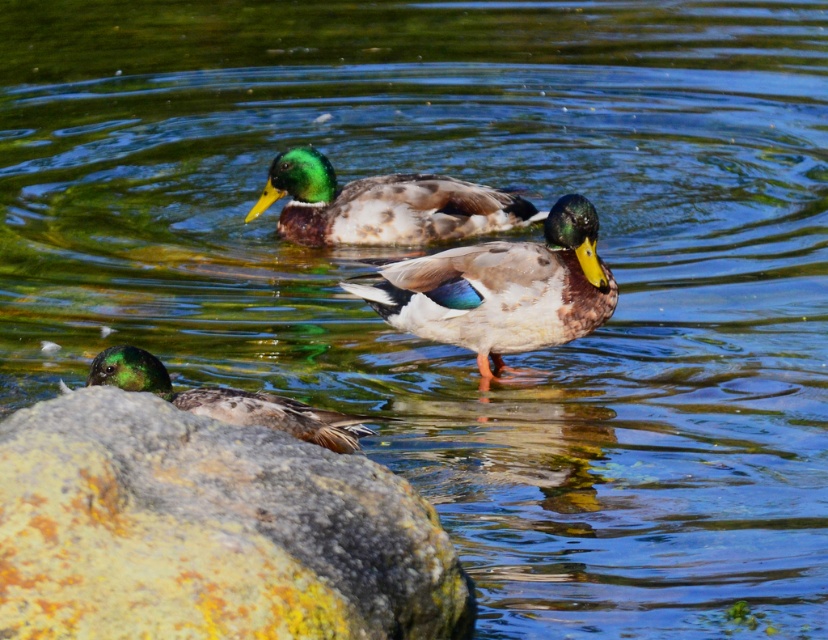
Can you confirm if speckled rock at lower left is shorter than shiny brown duck at center?

Yes.

Does speckled rock at lower left have a greater width compared to shiny brown duck at center?

Incorrect, speckled rock at lower left's width does not surpass shiny brown duck at center's.

Who is more forward, (299, 460) or (575, 324)?

Point (299, 460) is in front.

In order to click on speckled rock at lower left in this screenshot , I will do `click(207, 531)`.

Is shiny brown duck at center positioned before shiny green head at upper center?

Yes.

Can you confirm if shiny brown duck at center is positioned below shiny green head at upper center?

Yes.

Identify the location of shiny brown duck at center. (502, 289).

Identify the location of shiny brown duck at center. The width and height of the screenshot is (828, 640). (502, 289).

Which is more to the left, speckled rock at lower left or green glossy duck at lower left?

From the viewer's perspective, green glossy duck at lower left appears more on the left side.

Consider the image. Does speckled rock at lower left appear on the left side of green glossy duck at lower left?

Incorrect, speckled rock at lower left is not on the left side of green glossy duck at lower left.

Is point (27, 547) positioned behind point (137, 388)?

That is False.

Where is `speckled rock at lower left`? speckled rock at lower left is located at coordinates (207, 531).